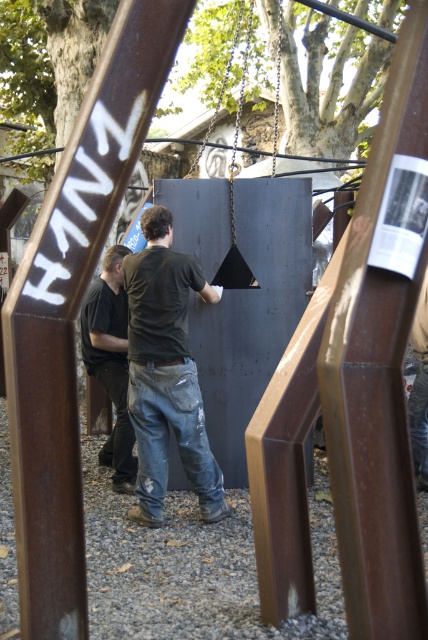
Which of these two, brushed metal sign at upper left or black cotton shirt at center, stands taller?

black cotton shirt at center

Identify the location of brushed metal sign at upper left. This screenshot has height=640, width=428. (82, 205).

Between black matte shirt at center and brushed metal sign at upper left, which one has less height?

brushed metal sign at upper left is shorter.

Where is `black matte shirt at center`? black matte shirt at center is located at coordinates (166, 372).

Where is `black matte shirt at center`? The image size is (428, 640). black matte shirt at center is located at coordinates (166, 372).

Which is more to the right, black matte shirt at center or black cotton shirt at center?

black matte shirt at center is more to the right.

You are a GUI agent. You are given a task and a screenshot of the screen. Output one action in this format:
    pyautogui.click(x=<x>, y=<y>)
    Task: Click on the black matte shirt at center
    
    Given the screenshot: What is the action you would take?
    pyautogui.click(x=166, y=372)

Find the location of `black matte shirt at center`. black matte shirt at center is located at coordinates (166, 372).